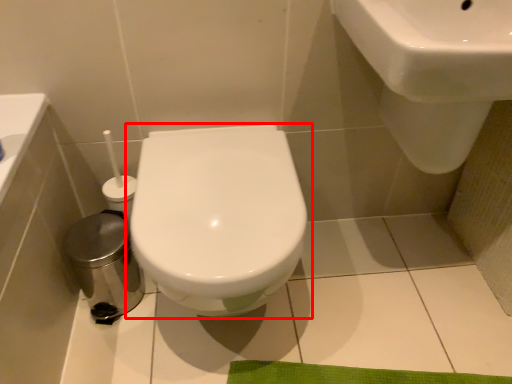
Question: From the image's perspective, what is the correct spatial relationship of toilet (annotated by the red box) in relation to sink?

Choices:
 (A) above
 (B) below

Answer: (B)